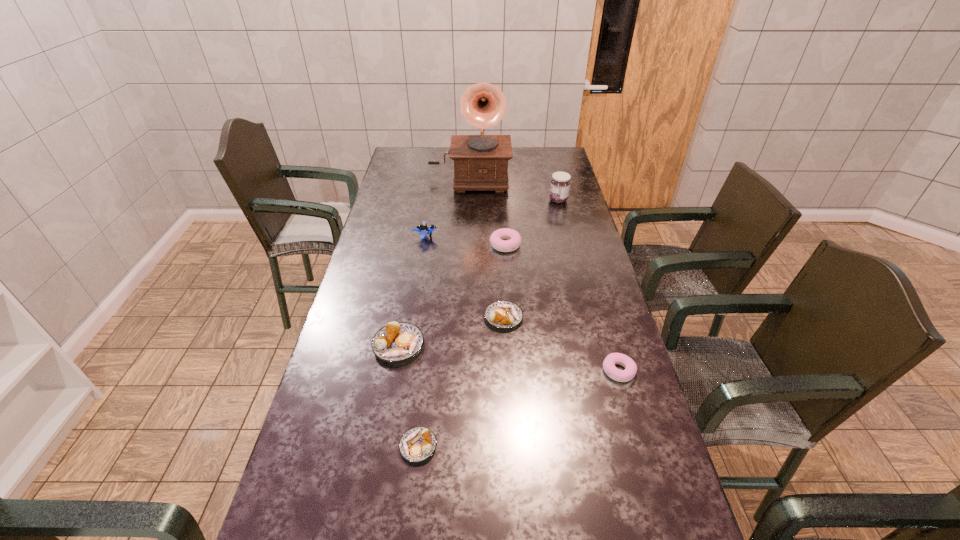
In the image, there is a desktop. Where is `vacant space at the right edge`? The height and width of the screenshot is (540, 960). vacant space at the right edge is located at coordinates [x=578, y=225].

Where is `vacant space at the far left corner`? vacant space at the far left corner is located at coordinates (407, 168).

The image size is (960, 540). Find the location of `empty location between the nearest brown pastry and the biggest brown pastry`. empty location between the nearest brown pastry and the biggest brown pastry is located at coordinates (408, 396).

The image size is (960, 540). Identify the location of empty space between the nearest pastry and the farthest pastry. (462, 346).

Where is `blank region between the rightmost brown pastry and the nearer pink pastry`? blank region between the rightmost brown pastry and the nearer pink pastry is located at coordinates (561, 344).

Where is `unoccupied position between the biggest brown pastry and the brown record player`? The image size is (960, 540). unoccupied position between the biggest brown pastry and the brown record player is located at coordinates (434, 261).

Locate an element on the screen. free spot between the biggest brown pastry and the farthest pastry is located at coordinates (452, 295).

You are a GUI agent. You are given a task and a screenshot of the screen. Output one action in this format:
    pyautogui.click(x=<x>, y=<y>)
    Task: Click on the free space between the biggest brown pastry and the smallest brown pastry
    The image size is (960, 540).
    Given the screenshot: What is the action you would take?
    pyautogui.click(x=408, y=396)

Locate an element on the screen. The width and height of the screenshot is (960, 540). free spot between the Lego and the rightmost brown pastry is located at coordinates (465, 277).

Where is `empty space between the right pink pastry and the second farthest object`? empty space between the right pink pastry and the second farthest object is located at coordinates (588, 286).